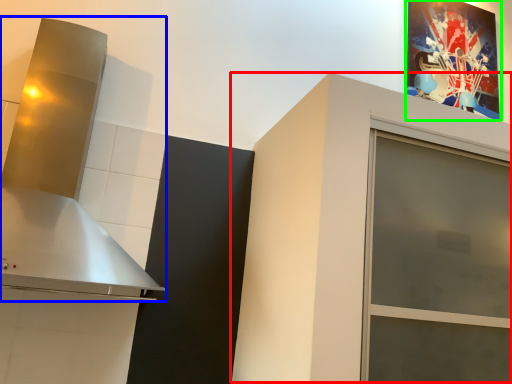
Question: Estimate the real-world distances between objects in this image. Which object is closer to cabinetry (highlighted by a red box), vent (highlighted by a blue box) or picture frame (highlighted by a green box)?

Choices:
 (A) vent
 (B) picture frame

Answer: (A)